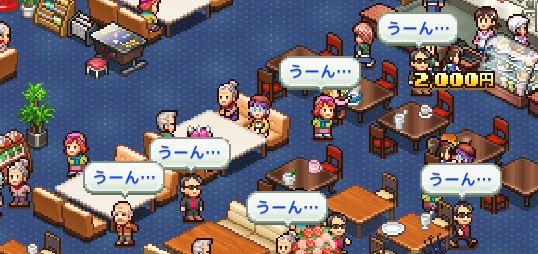
This screenshot has height=254, width=538. I want to click on plant, so click(x=45, y=110).